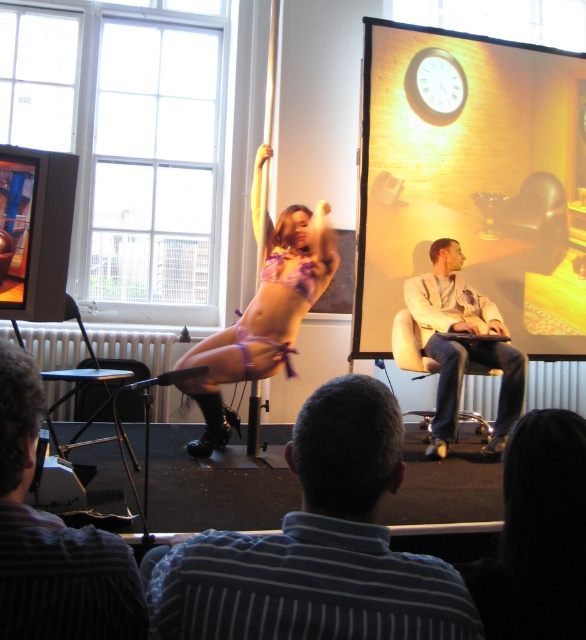
Question: Considering the relative positions of striped shirt at lower left and brushed metal speaker at left in the image provided, where is striped shirt at lower left located with respect to brushed metal speaker at left?

Choices:
 (A) left
 (B) right

Answer: (B)

Question: Which point is closer to the camera?

Choices:
 (A) light beige leather jacket at center
 (B) leather chair at center
 (C) striped shirt at center

Answer: (C)

Question: Does light beige leather jacket at center appear over brushed metal speaker at left?

Choices:
 (A) no
 (B) yes

Answer: (A)

Question: Which point is closer to the camera?

Choices:
 (A) matte gold clock at upper center
 (B) leather chair at center
 (C) purple satin bikini at center

Answer: (C)

Question: Is striped shirt at center to the left of brushed metal speaker at left from the viewer's perspective?

Choices:
 (A) yes
 (B) no

Answer: (B)

Question: Which point appears closest to the camera in this image?

Choices:
 (A) (98, 374)
 (B) (411, 340)
 (C) (4, 186)

Answer: (C)